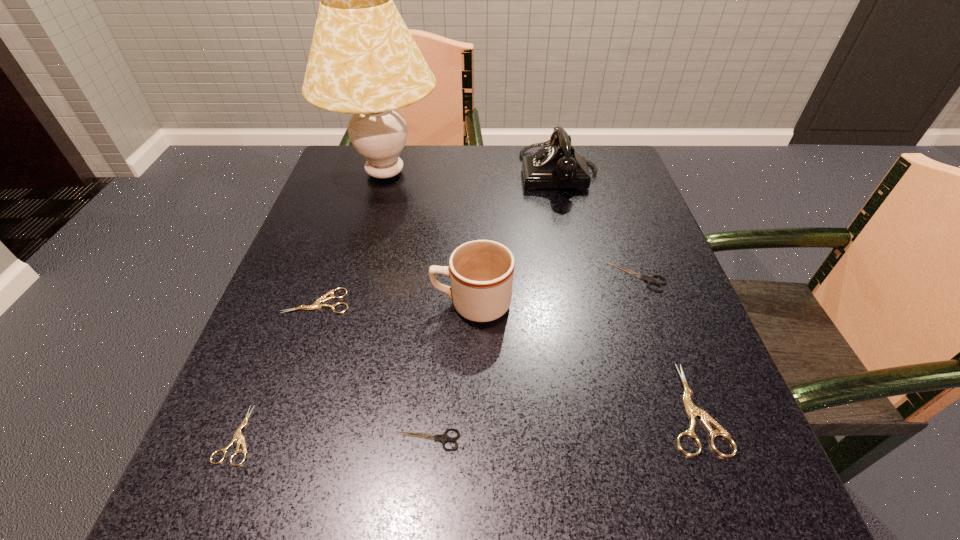
Locate an element on the screen. empty space that is in between the third shears from right to left and the shortest shears is located at coordinates (333, 437).

You are a GUI agent. You are given a task and a screenshot of the screen. Output one action in this format:
    pyautogui.click(x=<x>, y=<y>)
    Task: Click on the vacant area that lies between the nearer black shears and the tallest object
    
    Given the screenshot: What is the action you would take?
    point(406,306)

I want to click on blank region between the smallest beige shears and the biggest beige shears, so click(x=465, y=421).

Locate an element on the screen. empty space that is in between the farthest beige shears and the black telephone is located at coordinates (439, 237).

Image resolution: width=960 pixels, height=540 pixels. What are the coordinates of `free space that is in between the brown mug and the left black shears` in the screenshot? It's located at (449, 372).

Where is `empty space that is in between the brown mug and the smaller black shears`? empty space that is in between the brown mug and the smaller black shears is located at coordinates (449, 372).

Image resolution: width=960 pixels, height=540 pixels. What are the coordinates of `blank region between the telephone and the lampshade` in the screenshot? It's located at (472, 173).

Choose which object is the second nearest neighbor to the rightmost beige shears. Please provide its 2D coordinates. Your answer should be formatted as a tuple, i.e. [(x, y)], where the tuple contains the x and y coordinates of a point satisfying the conditions above.

[(481, 272)]

At what (x,y) coordinates should I click in order to perform the action: click on object that is the closest one to the shortest shears. Please return your answer as a coordinate pair (x, y). Looking at the image, I should click on (316, 305).

Select which shears appears as the second closest to the lampshade. Please provide its 2D coordinates. Your answer should be formatted as a tuple, i.e. [(x, y)], where the tuple contains the x and y coordinates of a point satisfying the conditions above.

[(649, 279)]